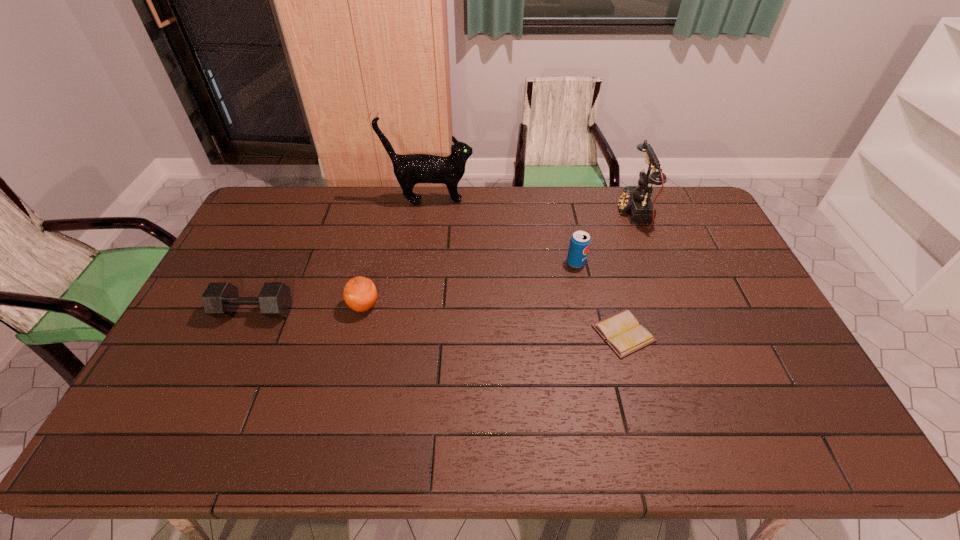
The image size is (960, 540). What are the coordinates of `free space at the left edge` in the screenshot? It's located at (203, 389).

Identify the location of blank space at the far right corner. (674, 215).

The width and height of the screenshot is (960, 540). I want to click on vacant area that lies between the cat and the soda can, so click(503, 232).

Where is `free spot between the tallest object and the soda can`? The image size is (960, 540). free spot between the tallest object and the soda can is located at coordinates (503, 232).

Where is `free space that is in between the soda can and the rightmost object`? The image size is (960, 540). free space that is in between the soda can and the rightmost object is located at coordinates (605, 238).

Find the location of a particular element. The width and height of the screenshot is (960, 540). vacant region between the shortest object and the cat is located at coordinates (526, 267).

Where is `free space between the leftmost object and the orange`? free space between the leftmost object and the orange is located at coordinates (309, 308).

What are the coordinates of `empty space between the fourth nearest object and the dumbbell` in the screenshot? It's located at (416, 287).

Locate an element on the screen. blank region between the telephone and the soda can is located at coordinates (605, 238).

Identify the location of free spot between the shortest object and the telephone. This screenshot has height=540, width=960. (629, 273).